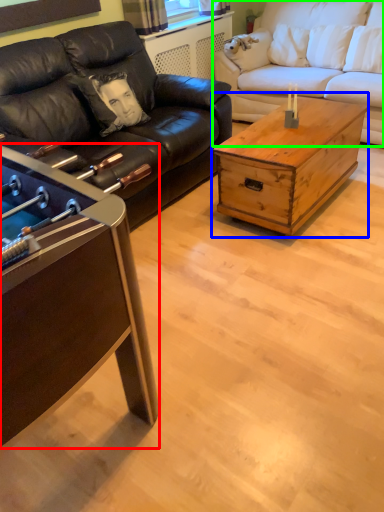
Question: Estimate the real-world distances between objects in this image. Which object is farther from coffee table (highlighted by a red box), coffee table (highlighted by a blue box) or studio couch (highlighted by a green box)?

Choices:
 (A) coffee table
 (B) studio couch

Answer: (B)